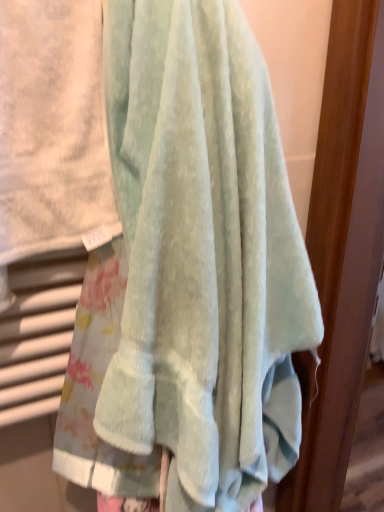
Question: Is sage green towel at center, which is the 2th towel in right-to-left order, far from light blue cotton towel at center, the 2th towel when ordered from left to right?

Choices:
 (A) yes
 (B) no

Answer: (B)

Question: From the image's perspective, is sage green towel at center, placed as the 1th towel when sorted from left to right, located beneath light blue cotton towel at center, the 2th towel when ordered from left to right?

Choices:
 (A) no
 (B) yes

Answer: (A)

Question: Is sage green towel at center, which is the 2th towel in right-to-left order, thinner than light blue cotton towel at center, the 2th towel when ordered from left to right?

Choices:
 (A) yes
 (B) no

Answer: (A)

Question: Is sage green towel at center, which is the 2th towel in right-to-left order, wider than light blue cotton towel at center, the 1th towel from the right?

Choices:
 (A) yes
 (B) no

Answer: (B)

Question: Are sage green towel at center, placed as the 1th towel when sorted from left to right, and light blue cotton towel at center, the 1th towel from the right, beside each other?

Choices:
 (A) no
 (B) yes

Answer: (A)

Question: Could you tell me if sage green towel at center, placed as the 1th towel when sorted from left to right, is turned towards light blue cotton towel at center, the 2th towel when ordered from left to right?

Choices:
 (A) yes
 (B) no

Answer: (B)

Question: Is light blue cotton towel at center, the 1th towel from the right, taller than sage green towel at center, placed as the 1th towel when sorted from left to right?

Choices:
 (A) yes
 (B) no

Answer: (A)

Question: Does light blue cotton towel at center, the 2th towel when ordered from left to right, have a smaller size compared to sage green towel at center, placed as the 1th towel when sorted from left to right?

Choices:
 (A) yes
 (B) no

Answer: (B)

Question: Is light blue cotton towel at center, the 2th towel when ordered from left to right, oriented away from sage green towel at center, which is the 2th towel in right-to-left order?

Choices:
 (A) no
 (B) yes

Answer: (A)

Question: Is sage green towel at center, placed as the 1th towel when sorted from left to right, completely or partially inside light blue cotton towel at center, the 2th towel when ordered from left to right?

Choices:
 (A) yes
 (B) no

Answer: (A)

Question: From a real-world perspective, is light blue cotton towel at center, the 1th towel from the right, positioned over sage green towel at center, placed as the 1th towel when sorted from left to right, based on gravity?

Choices:
 (A) no
 (B) yes

Answer: (A)

Question: From the image's perspective, is light blue cotton towel at center, the 2th towel when ordered from left to right, below sage green towel at center, placed as the 1th towel when sorted from left to right?

Choices:
 (A) no
 (B) yes

Answer: (B)

Question: From the image's perspective, is sage green towel at center, placed as the 1th towel when sorted from left to right, located above or below light blue cotton towel at center, the 1th towel from the right?

Choices:
 (A) above
 (B) below

Answer: (A)